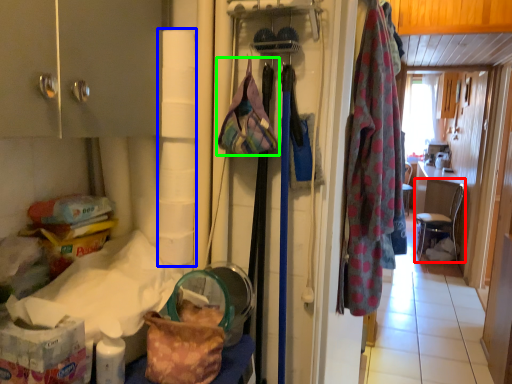
Question: Which object is positioned closest to chair (highlighted by a red box)? Select from toilet paper (highlighted by a blue box) and handbag (highlighted by a green box).

Choices:
 (A) toilet paper
 (B) handbag

Answer: (B)